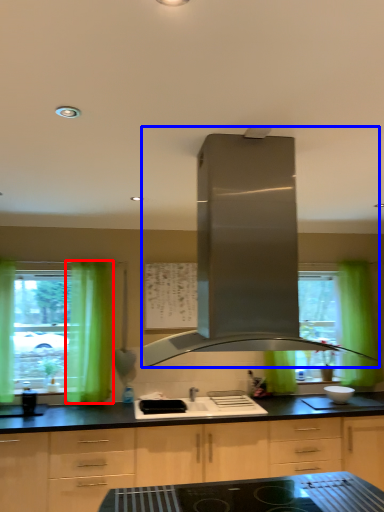
Question: Which point is further to the camera, curtain (highlighted by a red box) or home appliance (highlighted by a blue box)?

Choices:
 (A) curtain
 (B) home appliance

Answer: (A)